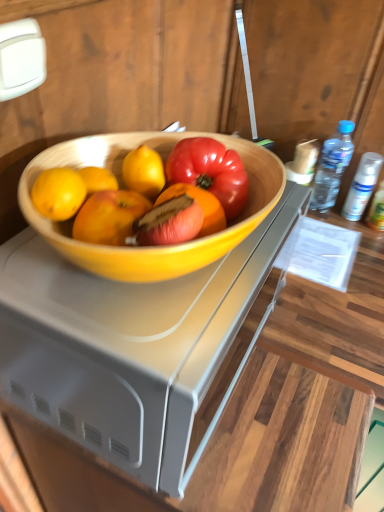
Question: Is wooden desk at center oriented away from clear plastic spray can at upper right, the 3th bottle when ordered from left to right?

Choices:
 (A) yes
 (B) no

Answer: (B)

Question: Is the depth of wooden desk at center less than that of clear plastic spray can at upper right, the 3th bottle when ordered from left to right?

Choices:
 (A) yes
 (B) no

Answer: (A)

Question: Does wooden desk at center appear on the right side of clear plastic spray can at upper right, which is the 1th bottle in right-to-left order?

Choices:
 (A) yes
 (B) no

Answer: (B)

Question: Considering the relative sizes of wooden desk at center and clear plastic spray can at upper right, the 3th bottle when ordered from left to right, in the image provided, is wooden desk at center wider than clear plastic spray can at upper right, the 3th bottle when ordered from left to right,?

Choices:
 (A) no
 (B) yes

Answer: (B)

Question: Considering the relative sizes of wooden desk at center and clear plastic spray can at upper right, which is the 1th bottle in right-to-left order, in the image provided, is wooden desk at center thinner than clear plastic spray can at upper right, which is the 1th bottle in right-to-left order,?

Choices:
 (A) yes
 (B) no

Answer: (B)

Question: Is wooden desk at center positioned beyond the bounds of clear plastic spray can at upper right, the 3th bottle when ordered from left to right?

Choices:
 (A) no
 (B) yes

Answer: (B)

Question: Considering the relative sizes of white matte spray can at right, acting as the second bottle starting from the right, and transparent plastic bottle at right, the 1th bottle when ordered from left to right, in the image provided, is white matte spray can at right, acting as the second bottle starting from the right, smaller than transparent plastic bottle at right, the 1th bottle when ordered from left to right,?

Choices:
 (A) no
 (B) yes

Answer: (B)

Question: Is white matte spray can at right, acting as the second bottle starting from the right, at the right side of transparent plastic bottle at right, the 3th bottle viewed from the right?

Choices:
 (A) no
 (B) yes

Answer: (B)

Question: Can you confirm if white matte spray can at right, which is the 2th bottle in left-to-right order, is taller than transparent plastic bottle at right, the 3th bottle viewed from the right?

Choices:
 (A) no
 (B) yes

Answer: (A)

Question: Does white matte spray can at right, acting as the second bottle starting from the right, lie behind transparent plastic bottle at right, the 3th bottle viewed from the right?

Choices:
 (A) yes
 (B) no

Answer: (A)

Question: Is white matte spray can at right, acting as the second bottle starting from the right, positioned in front of transparent plastic bottle at right, the 1th bottle when ordered from left to right?

Choices:
 (A) no
 (B) yes

Answer: (A)

Question: Can you confirm if white matte spray can at right, which is the 2th bottle in left-to-right order, is positioned to the left of transparent plastic bottle at right, the 3th bottle viewed from the right?

Choices:
 (A) yes
 (B) no

Answer: (B)

Question: Is clear plastic spray can at upper right, which is the 1th bottle in right-to-left order, beside wooden desk at center?

Choices:
 (A) yes
 (B) no

Answer: (B)